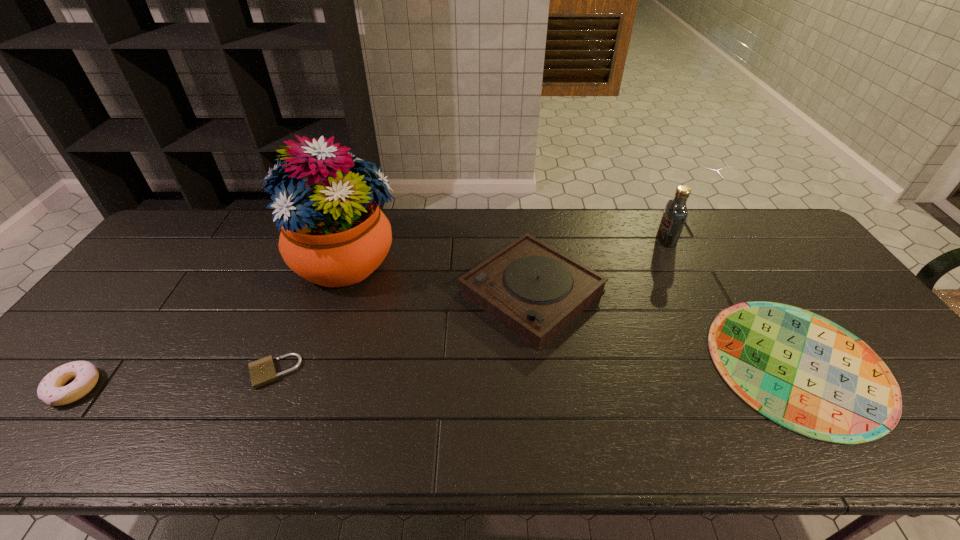
You are a GUI agent. You are given a task and a screenshot of the screen. Output one action in this format:
    pyautogui.click(x=<x>, y=<y>)
    Task: Click on the object located at the left edge
    This screenshot has height=540, width=960.
    Given the screenshot: What is the action you would take?
    pyautogui.click(x=51, y=390)

At what (x,y) coordinates should I click in order to perform the action: click on object at the right edge. Please return your answer as a coordinate pair (x, y). The image size is (960, 540). Looking at the image, I should click on (802, 371).

Image resolution: width=960 pixels, height=540 pixels. Identify the location of object present at the near right corner. (802, 371).

At what (x,y) coordinates should I click in order to perform the action: click on free space at the far edge. Please return your answer as a coordinate pair (x, y). Looking at the image, I should click on (733, 226).

I want to click on blank area at the near edge, so click(x=773, y=455).

Where is `vacant point at the left edge`? This screenshot has width=960, height=540. vacant point at the left edge is located at coordinates (89, 324).

In the image, there is a desktop. Identify the location of vacant space at the far right corner. This screenshot has width=960, height=540. (793, 249).

This screenshot has height=540, width=960. In order to click on free spot at the near right corner of the desktop in this screenshot , I will do `click(930, 436)`.

This screenshot has height=540, width=960. Identify the location of free space between the fourth shortest object and the fifth tallest object. (402, 332).

What are the coordinates of `unoccupied area between the shortest object and the vodka` in the screenshot? It's located at (732, 302).